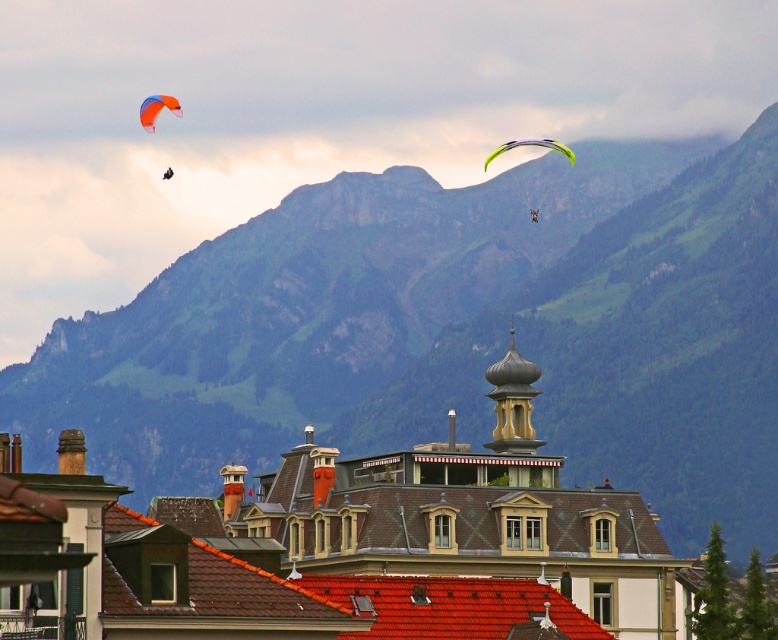
In the scene shown: Does green grassy mountain at upper center have a greater height compared to orange fabric parachute at upper left?

Yes, green grassy mountain at upper center is taller than orange fabric parachute at upper left.

Between point (692, 157) and point (149, 122), which one is positioned in front?

Point (149, 122) is in front.

In order to click on green grassy mountain at upper center in this screenshot , I will do `click(456, 332)`.

Which is more to the right, brown tiled roof at center or orange fabric parasail at upper left?

From the viewer's perspective, brown tiled roof at center appears more on the right side.

Is brown tiled roof at center shorter than orange fabric parasail at upper left?

Incorrect, brown tiled roof at center's height does not fall short of orange fabric parasail at upper left's.

Where is `brown tiled roof at center`? The width and height of the screenshot is (778, 640). brown tiled roof at center is located at coordinates (451, 516).

Does brown tiled roof at center have a larger size compared to orange fabric parachute at upper left?

Yes.

Does brown tiled roof at center appear on the left side of orange fabric parachute at upper left?

Incorrect, brown tiled roof at center is not on the left side of orange fabric parachute at upper left.

Is point (429, 516) farther from camera compared to point (153, 125)?

That is False.

You are a GUI agent. You are given a task and a screenshot of the screen. Output one action in this format:
    pyautogui.click(x=<x>, y=<y>)
    Task: Click on the brown tiled roof at center
    The image size is (778, 640).
    Given the screenshot: What is the action you would take?
    pyautogui.click(x=451, y=516)